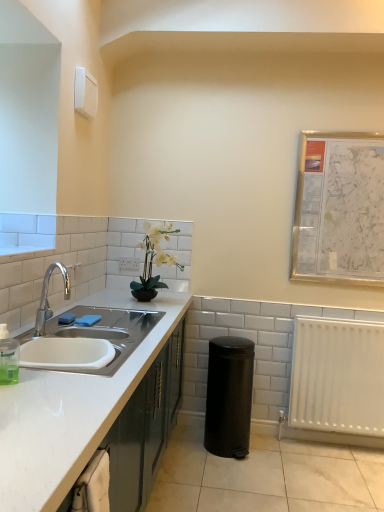
Question: Is the position of black matte trash can at lower right more distant than that of white matte radiator at lower right?

Choices:
 (A) no
 (B) yes

Answer: (A)

Question: Is black matte trash can at lower right to the left of white matte radiator at lower right from the viewer's perspective?

Choices:
 (A) no
 (B) yes

Answer: (B)

Question: From the image's perspective, does black matte trash can at lower right appear higher than white matte radiator at lower right?

Choices:
 (A) yes
 (B) no

Answer: (B)

Question: Considering the relative sizes of black matte trash can at lower right and white matte radiator at lower right in the image provided, is black matte trash can at lower right thinner than white matte radiator at lower right?

Choices:
 (A) no
 (B) yes

Answer: (A)

Question: Is black matte trash can at lower right far from white matte radiator at lower right?

Choices:
 (A) yes
 (B) no

Answer: (B)

Question: Is black matte trash can at lower right smaller than white matte radiator at lower right?

Choices:
 (A) no
 (B) yes

Answer: (A)

Question: Is white matte vase at center to the right of white matte cabinet at left from the viewer's perspective?

Choices:
 (A) no
 (B) yes

Answer: (B)

Question: From a real-world perspective, is white matte vase at center on white matte cabinet at left?

Choices:
 (A) yes
 (B) no

Answer: (A)

Question: Is white matte vase at center located outside white matte cabinet at left?

Choices:
 (A) yes
 (B) no

Answer: (A)

Question: Does white matte vase at center come behind white matte cabinet at left?

Choices:
 (A) yes
 (B) no

Answer: (A)

Question: Does white matte vase at center have a lesser width compared to white matte cabinet at left?

Choices:
 (A) no
 (B) yes

Answer: (B)

Question: From the image's perspective, is white matte vase at center located above white matte cabinet at left?

Choices:
 (A) yes
 (B) no

Answer: (A)

Question: Is white matte vase at center closer to the viewer compared to white matte radiator at lower right?

Choices:
 (A) no
 (B) yes

Answer: (B)